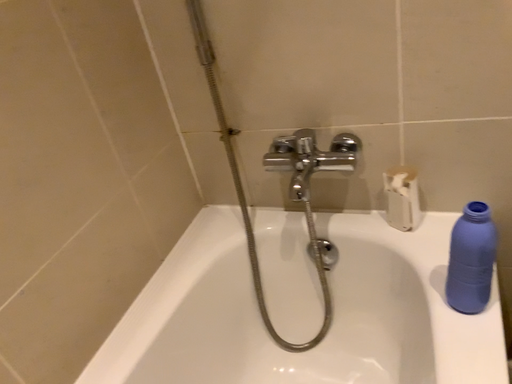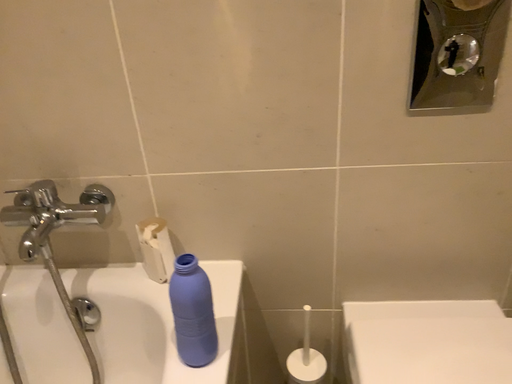
Question: How did the camera likely rotate when shooting the video?

Choices:
 (A) rotated downward
 (B) rotated upward

Answer: (B)